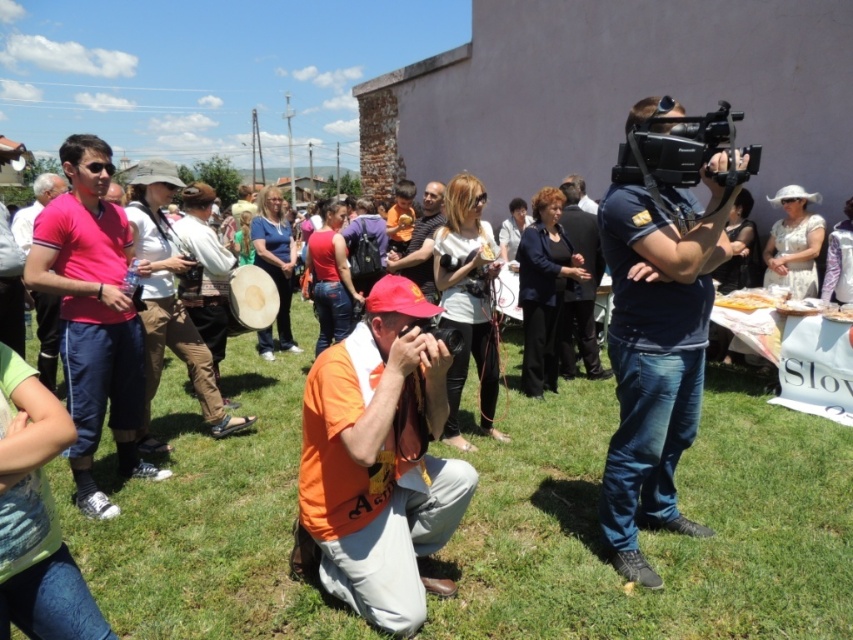
Which is below, dark blue denim jeans at center or black plastic video camera at upper right?

dark blue denim jeans at center is lower down.

Can you confirm if dark blue denim jeans at center is positioned below black plastic video camera at upper right?

Indeed, dark blue denim jeans at center is positioned under black plastic video camera at upper right.

Describe the element at coordinates (654, 353) in the screenshot. I see `dark blue denim jeans at center` at that location.

Image resolution: width=853 pixels, height=640 pixels. I want to click on dark blue denim jeans at center, so click(x=654, y=353).

Who is shorter, pink fabric shirt at left or dark blue suit at center?

dark blue suit at center is shorter.

You are a GUI agent. You are given a task and a screenshot of the screen. Output one action in this format:
    pyautogui.click(x=<x>, y=<y>)
    Task: Click on the pink fabric shirt at left
    
    Given the screenshot: What is the action you would take?
    pyautogui.click(x=93, y=316)

Which is behind, point (79, 212) or point (573, 300)?

Point (573, 300)

Locate an element on the screen. The width and height of the screenshot is (853, 640). pink fabric shirt at left is located at coordinates (93, 316).

Does green grass at center have a larger size compared to pink fabric shirt at left?

No.

Does green grass at center have a greater width compared to pink fabric shirt at left?

Yes.

Find the location of `green grass at center`. green grass at center is located at coordinates (653, 532).